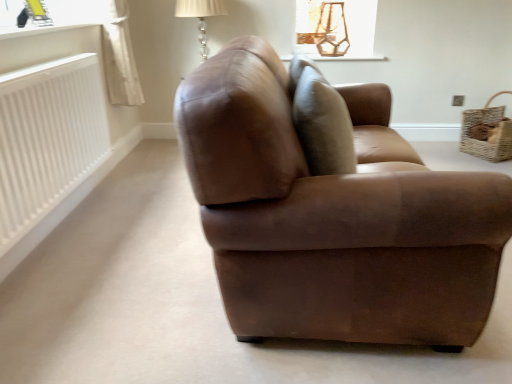
Question: Does brown leather couch at center have a greater width compared to brown leather swivel chair at center?

Choices:
 (A) no
 (B) yes

Answer: (B)

Question: Can you confirm if brown leather couch at center is positioned to the right of brown leather swivel chair at center?

Choices:
 (A) yes
 (B) no

Answer: (A)

Question: Is brown leather couch at center facing away from brown leather swivel chair at center?

Choices:
 (A) yes
 (B) no

Answer: (A)

Question: From the image's perspective, is brown leather couch at center located beneath brown leather swivel chair at center?

Choices:
 (A) yes
 (B) no

Answer: (A)

Question: Is brown leather couch at center completely or partially outside of brown leather swivel chair at center?

Choices:
 (A) no
 (B) yes

Answer: (B)

Question: Considering the positions of point (25, 97) and point (495, 115), is point (25, 97) closer or farther from the camera than point (495, 115)?

Choices:
 (A) closer
 (B) farther

Answer: (A)

Question: Considering the positions of white ribbed radiator at left and woven brown basket at right in the image, is white ribbed radiator at left taller or shorter than woven brown basket at right?

Choices:
 (A) short
 (B) tall

Answer: (B)

Question: Considering their positions, is white ribbed radiator at left located in front of or behind woven brown basket at right?

Choices:
 (A) front
 (B) behind

Answer: (A)

Question: Considering the positions of white ribbed radiator at left and woven brown basket at right in the image, is white ribbed radiator at left bigger or smaller than woven brown basket at right?

Choices:
 (A) big
 (B) small

Answer: (A)

Question: Relative to brown leather couch at center, is white glossy window sill at upper left, the 1th window sill when ordered from left to right, in front or behind?

Choices:
 (A) behind
 (B) front

Answer: (A)

Question: From a real-world perspective, relative to brown leather couch at center, is white glossy window sill at upper left, the 1th window sill when ordered from left to right, vertically above or below?

Choices:
 (A) below
 (B) above

Answer: (B)

Question: From the image's perspective, is white glossy window sill at upper left, which is counted as the second window sill, starting from the back, located above or below brown leather couch at center?

Choices:
 (A) below
 (B) above

Answer: (B)

Question: Do you think white glossy window sill at upper left, which is counted as the second window sill, starting from the back, is within brown leather couch at center, or outside of it?

Choices:
 (A) outside
 (B) inside

Answer: (A)

Question: From the image's perspective, is woven brown basket at right above or below white ribbed radiator at left?

Choices:
 (A) below
 (B) above

Answer: (B)

Question: Considering the positions of point (505, 135) and point (87, 119), is point (505, 135) closer or farther from the camera than point (87, 119)?

Choices:
 (A) closer
 (B) farther

Answer: (B)